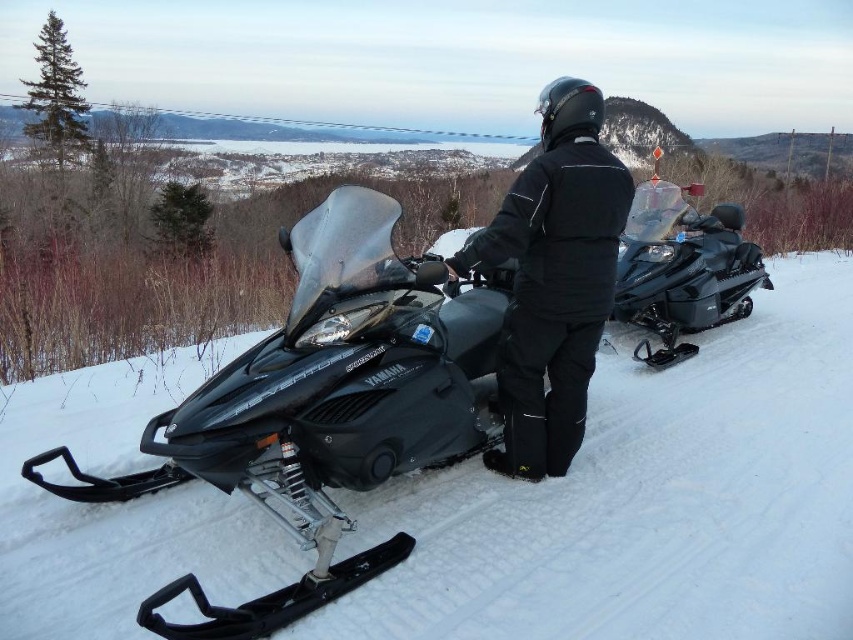
Can you confirm if matte black snowmobile at center is positioned to the right of shiny black snowmobile at right?

In fact, matte black snowmobile at center is to the left of shiny black snowmobile at right.

Between matte black snowmobile at center and shiny black snowmobile at right, which one has less height?

shiny black snowmobile at right is shorter.

Which is behind, point (260, 429) or point (668, 358)?

The point (668, 358) is more distant.

Locate an element on the screen. The width and height of the screenshot is (853, 640). matte black snowmobile at center is located at coordinates (326, 404).

Can you confirm if matte black snowmobile at center is shorter than black matte jacket at center?

Correct, matte black snowmobile at center is not as tall as black matte jacket at center.

The height and width of the screenshot is (640, 853). In order to click on matte black snowmobile at center in this screenshot , I will do `click(326, 404)`.

Describe the element at coordinates (326, 404) in the screenshot. This screenshot has width=853, height=640. I see `matte black snowmobile at center` at that location.

Identify the location of matte black snowmobile at center. (326, 404).

Can you confirm if black matte jacket at center is positioned above shiny black snowmobile at right?

Actually, black matte jacket at center is below shiny black snowmobile at right.

Between black matte jacket at center and shiny black snowmobile at right, which one appears on the left side from the viewer's perspective?

From the viewer's perspective, black matte jacket at center appears more on the left side.

Is point (622, 173) positioned behind point (718, 300)?

That is False.

Where is `black matte jacket at center`? black matte jacket at center is located at coordinates (553, 280).